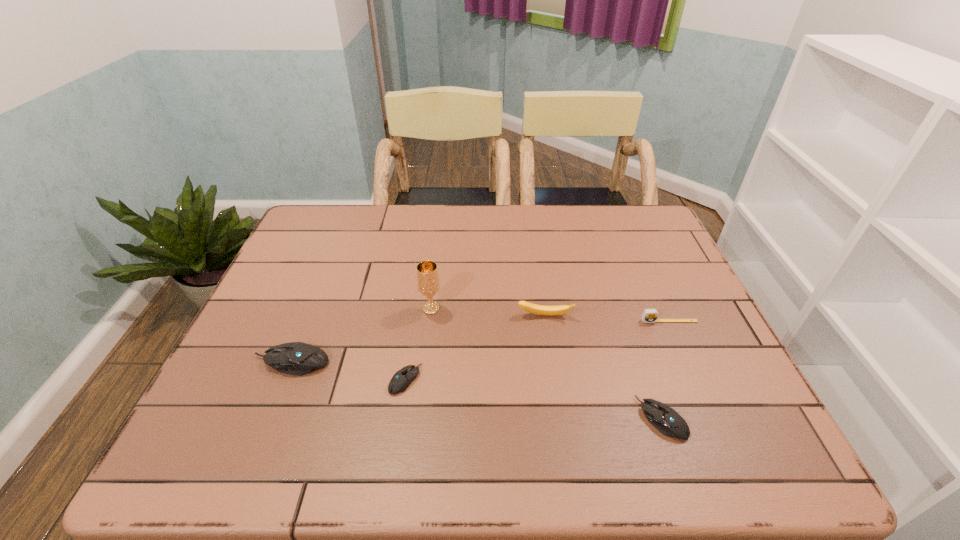
This screenshot has width=960, height=540. I want to click on vacant space at the far edge of the desktop, so click(x=510, y=244).

Where is `free location at the near edge of the desktop`? free location at the near edge of the desktop is located at coordinates (680, 413).

Find the location of a particular element. The height and width of the screenshot is (540, 960). vacant region at the left edge of the desktop is located at coordinates (312, 322).

Image resolution: width=960 pixels, height=540 pixels. In the image, there is a desktop. Find the location of `blank space at the right edge`. blank space at the right edge is located at coordinates [x=666, y=351].

This screenshot has width=960, height=540. In order to click on vacant space at the far left corner in this screenshot , I will do (346, 230).

Locate an element on the screen. The image size is (960, 540). vacant area at the near left corner of the desktop is located at coordinates 264,415.

In the image, there is a desktop. What are the coordinates of `vacant region at the near right corner` in the screenshot? It's located at (701, 386).

You are a GUI agent. You are given a task and a screenshot of the screen. Output one action in this format:
    pyautogui.click(x=<x>, y=<y>)
    Task: Click on the free point between the tape measure and the nearest computer mouse
    This screenshot has height=540, width=960.
    Given the screenshot: What is the action you would take?
    pyautogui.click(x=665, y=370)

Identify the location of empty space between the second tallest object and the tallest computer mouse. The width and height of the screenshot is (960, 540). (418, 339).

Locate an element on the screen. This screenshot has height=540, width=960. vacant point located between the banana and the shortest computer mouse is located at coordinates (475, 348).